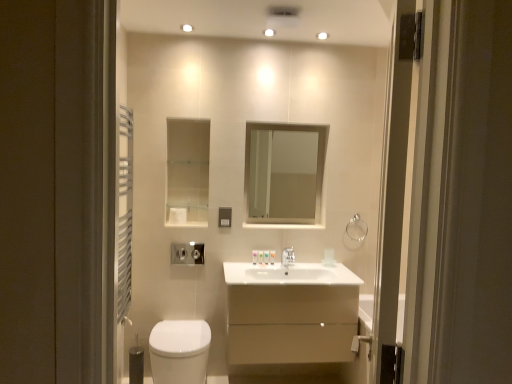
I want to click on unoccupied region to the right of silver metallic faucet at center, so click(309, 266).